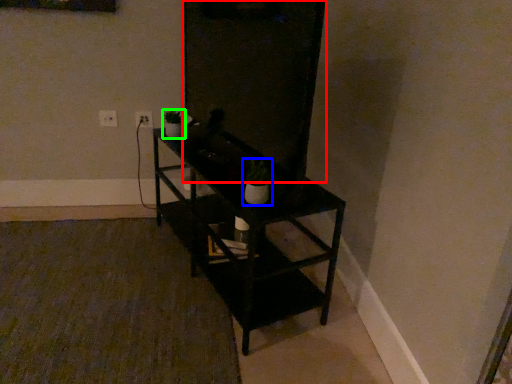
Question: Considering the real-world distances, which object is farthest from glass door (highlighted by a red box)? houseplant (highlighted by a blue box) or houseplant (highlighted by a green box)?

Choices:
 (A) houseplant
 (B) houseplant

Answer: (B)